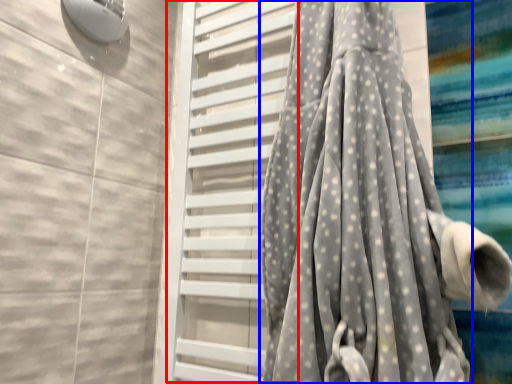
Question: Among these objects, which one is farthest to the camera, screen door (highlighted by a red box) or curtain (highlighted by a blue box)?

Choices:
 (A) screen door
 (B) curtain

Answer: (A)